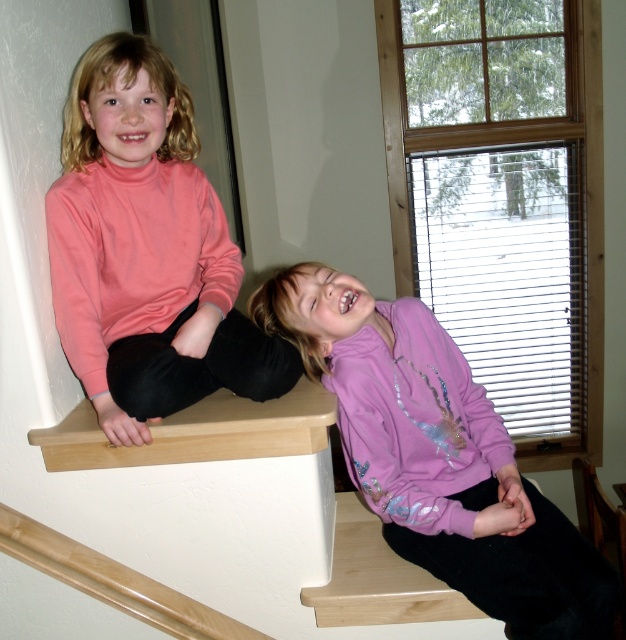
Question: From the image, what is the correct spatial relationship of pink turtleneck sweater at upper left in relation to purple fleece jacket at upper right?

Choices:
 (A) below
 (B) above

Answer: (B)

Question: Can you confirm if pink turtleneck sweater at upper left is positioned below purple fleece jacket at upper right?

Choices:
 (A) yes
 (B) no

Answer: (B)

Question: Is pink turtleneck sweater at upper left to the right of purple fleece jacket at upper right from the viewer's perspective?

Choices:
 (A) no
 (B) yes

Answer: (A)

Question: Which object appears closest to the camera in this image?

Choices:
 (A) pink turtleneck sweater at upper left
 (B) purple fleece jacket at upper right

Answer: (B)

Question: Which object appears farthest from the camera in this image?

Choices:
 (A) purple fleece jacket at upper right
 (B) pink turtleneck sweater at upper left

Answer: (B)

Question: Which point is closer to the camera?

Choices:
 (A) pink turtleneck sweater at upper left
 (B) purple fleece jacket at upper right

Answer: (B)